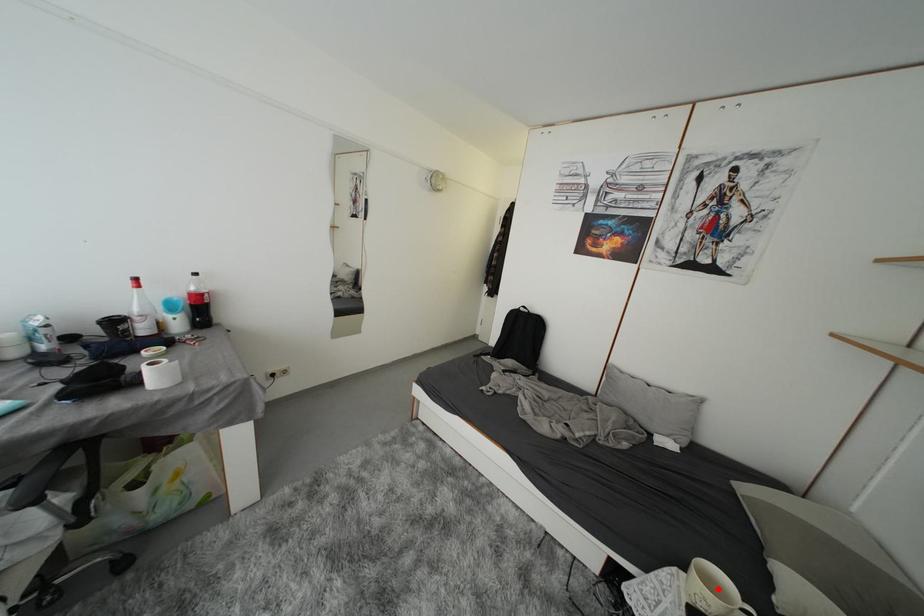
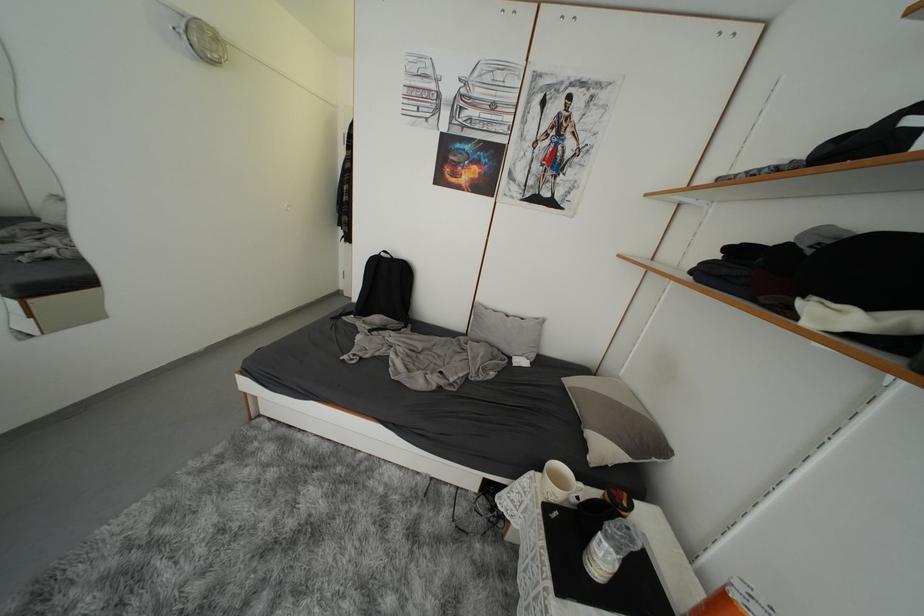
Find the pixel in the second image that matches the highlighted location in the first image.

(565, 484)